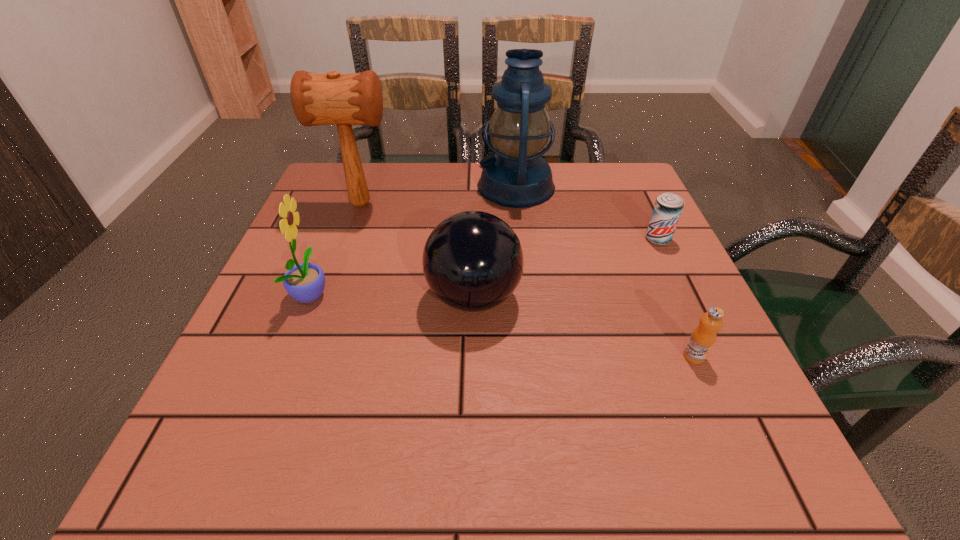
This screenshot has width=960, height=540. I want to click on vacant area located 0.100m on the front-facing side of the sunflower, so [x=383, y=293].

Find the location of `free location located on the side of the third shortest object with the finger holes`. free location located on the side of the third shortest object with the finger holes is located at coordinates (665, 297).

Image resolution: width=960 pixels, height=540 pixels. What are the coordinates of `vacant space situated on the front label of the orange juice` in the screenshot? It's located at (726, 429).

Find the location of `vacant space located on the left of the beer can`. vacant space located on the left of the beer can is located at coordinates pos(468,239).

Where is `lantern present at the far edge`? Image resolution: width=960 pixels, height=540 pixels. lantern present at the far edge is located at coordinates (519, 128).

Identify the location of mallet that is positioned at the far edge. [317, 99].

Identify the location of mallet present at the left edge. (317, 99).

Identify the location of sunflower that is at the left edge. The height and width of the screenshot is (540, 960). (305, 282).

This screenshot has width=960, height=540. Identify the location of orange juice that is positioned at the right edge. (703, 337).

The width and height of the screenshot is (960, 540). I want to click on beer can positioned at the right edge, so 668,207.